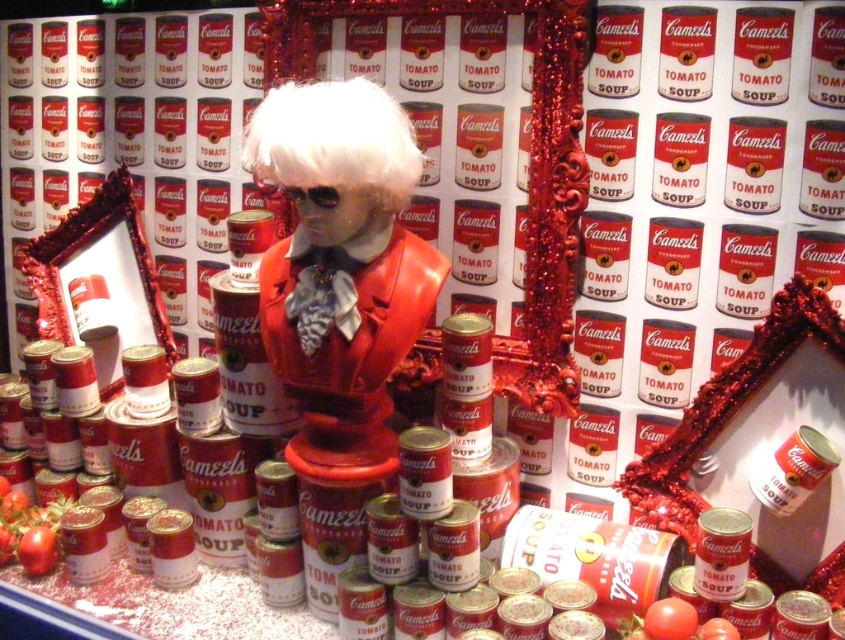
Is the position of shiny plastic bust at center more distant than that of white matte wig at center?

Yes, shiny plastic bust at center is further from the viewer.

Does shiny plastic bust at center appear under white matte wig at center?

Yes.

You are a GUI agent. You are given a task and a screenshot of the screen. Output one action in this format:
    pyautogui.click(x=<x>, y=<y>)
    Task: Click on the shiny plastic bust at center
    Image resolution: width=845 pixels, height=640 pixels.
    Given the screenshot: What is the action you would take?
    pyautogui.click(x=341, y=266)

At what (x,y) coordinates should I click in order to perform the action: click on shiny plastic bust at center. Please return your answer as a coordinate pair (x, y). The height and width of the screenshot is (640, 845). Looking at the image, I should click on click(341, 266).